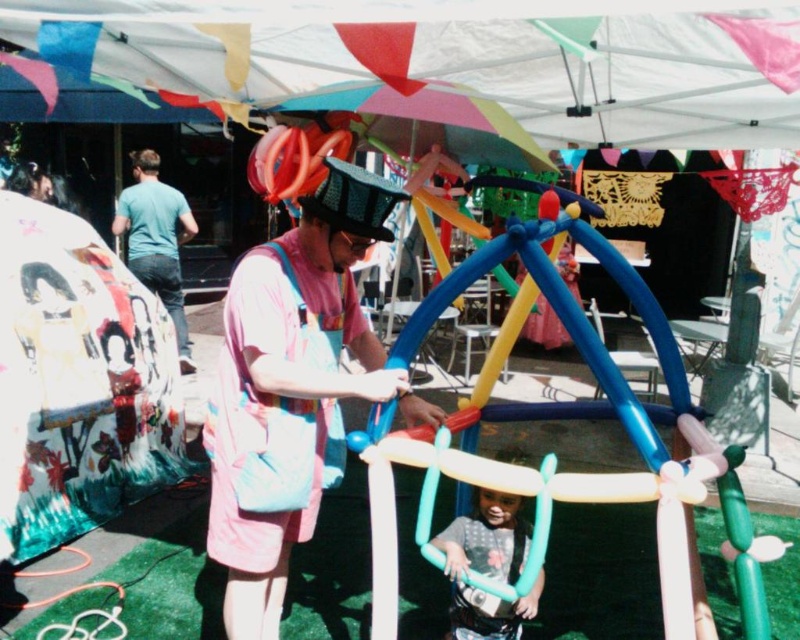
Who is taller, matte blue balloon at center or teal t-shirt at left?

teal t-shirt at left is taller.

Is point (504, 628) positioned behind point (178, 257)?

No, (504, 628) is closer to viewer.

Where is `matte blue balloon at center`? The width and height of the screenshot is (800, 640). matte blue balloon at center is located at coordinates (488, 566).

Is multicolored fabric canopy at upper center above teal t-shirt at left?

Correct, multicolored fabric canopy at upper center is located above teal t-shirt at left.

Does point (392, 64) lie behind point (193, 364)?

No, it is in front of (193, 364).

Where is `multicolored fabric canopy at upper center`? multicolored fabric canopy at upper center is located at coordinates (458, 60).

This screenshot has height=640, width=800. What do you see at coordinates (292, 388) in the screenshot?
I see `pink fabric bag at center` at bounding box center [292, 388].

Is pink fabric bag at center to the left of teal t-shirt at left from the viewer's perspective?

Incorrect, pink fabric bag at center is not on the left side of teal t-shirt at left.

Measure the distance between pink fabric bag at center and camera.

They are 5.54 feet apart.

Find the location of a particular element. pink fabric bag at center is located at coordinates (292, 388).